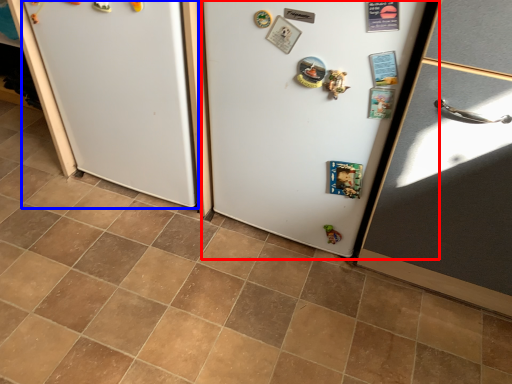
Question: Which of the following is the closest to the observer, fridge (highlighted by a red box) or fridge (highlighted by a blue box)?

Choices:
 (A) fridge
 (B) fridge

Answer: (A)